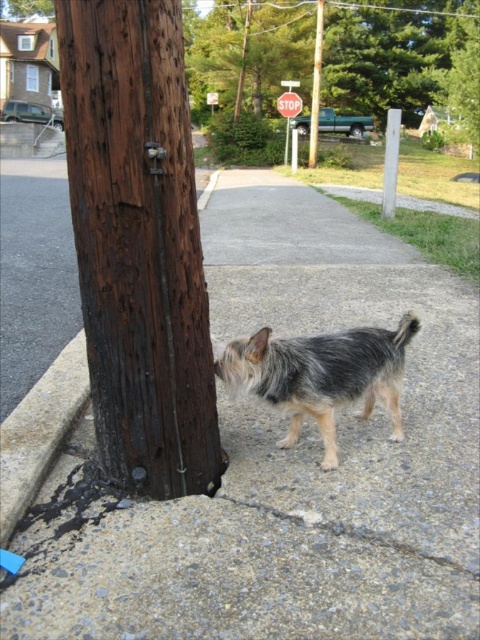
Between green leafy tree at upper center and fuzzy brown dog at upper right, which one is positioned lower?

fuzzy brown dog at upper right

Is point (250, 51) less distant than point (434, 124)?

Yes, it is in front of point (434, 124).

Does point (403, 64) come farther from viewer compared to point (433, 128)?

No, (403, 64) is closer to viewer.

Find the location of a particular element. This screenshot has height=640, width=480. green leafy tree at upper center is located at coordinates (389, 52).

Is point (278, 20) closer to camera compared to point (388, 188)?

No, (278, 20) is behind (388, 188).

Is point (407, 109) farther from camera compared to point (388, 118)?

Yes.

At what (x,y) coordinates should I click in order to perform the action: click on green leafy tree at upper center. Please return your answer as a coordinate pair (x, y). The height and width of the screenshot is (640, 480). Looking at the image, I should click on (389, 52).

Between gray concrete pavement at lower center and brown wooden pole at center, which one is positioned higher?

brown wooden pole at center is above.

Does point (245, 465) come closer to viewer compared to point (313, 67)?

Yes, it is in front of point (313, 67).

Is point (338, 605) positioned before point (308, 163)?

Yes, point (338, 605) is closer to viewer.

Find the location of a particular element. gray concrete pavement at lower center is located at coordinates (291, 467).